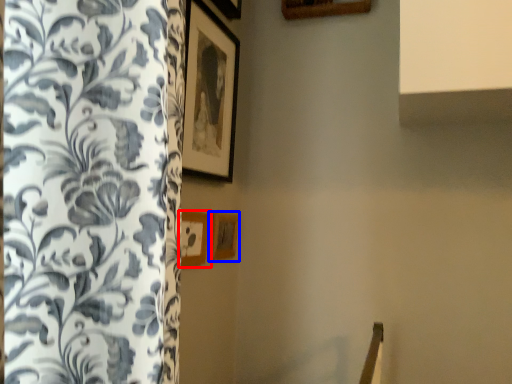
Question: Which object appears farthest to the camera in this image, picture frame (highlighted by a red box) or picture frame (highlighted by a blue box)?

Choices:
 (A) picture frame
 (B) picture frame

Answer: (B)